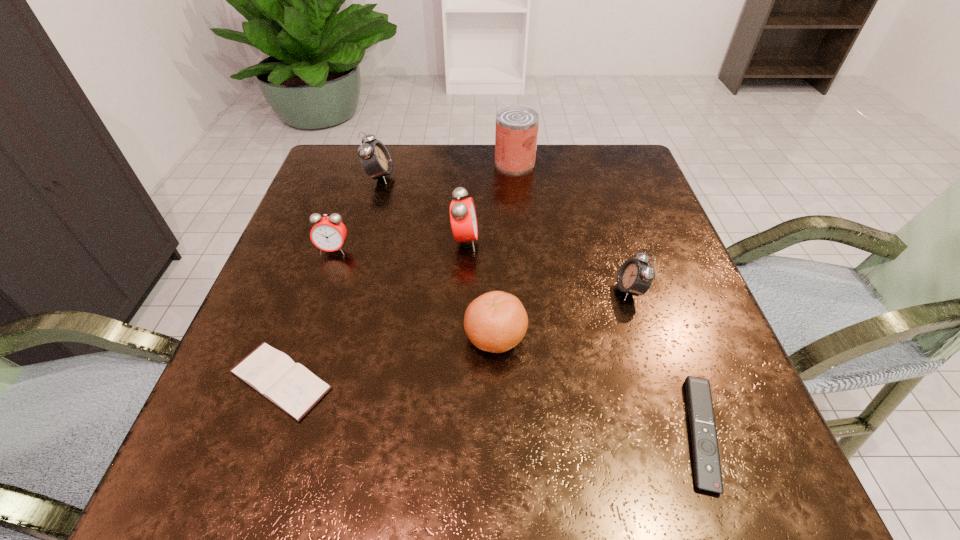
You are a GUI agent. You are given a task and a screenshot of the screen. Output one action in this format:
    pyautogui.click(x=<x>, y=<y>)
    Task: Click on the free spot located 0.290m on the back of the remote control
    The image size is (960, 540).
    Given the screenshot: What is the action you would take?
    pyautogui.click(x=638, y=259)

Identify the location of can located at the far edge. pos(516,133).

You are a GUI agent. You are given a task and a screenshot of the screen. Output one action in this format:
    pyautogui.click(x=<x>, y=<y>)
    Task: Click on the alarm clock at the far edge
    
    Given the screenshot: What is the action you would take?
    pyautogui.click(x=375, y=159)

You are a GUI agent. You are given a task and a screenshot of the screen. Output one action in this format:
    pyautogui.click(x=<x>, y=<y>)
    Task: Click on the object that is at the near edge
    This screenshot has width=960, height=540.
    Given the screenshot: What is the action you would take?
    pyautogui.click(x=707, y=468)

Find the location of a particular element. This screenshot has width=960, height=540. diary at the left edge is located at coordinates (290, 386).

In order to click on alarm clock positioned at the right edge in this screenshot , I will do (635, 277).

You are a GUI agent. You are given a task and a screenshot of the screen. Output one action in this format:
    pyautogui.click(x=<x>, y=<y>)
    Task: Click on the remote control that is at the right edge
    
    Given the screenshot: What is the action you would take?
    pyautogui.click(x=707, y=468)

Find the location of a particular element. Image resolution: width=960 pixels, height=540 pixels. object that is at the far left corner is located at coordinates (375, 159).

The height and width of the screenshot is (540, 960). I want to click on object that is positioned at the near right corner, so click(x=707, y=468).

Locate an element on the screen. This screenshot has height=540, width=960. free point at the far edge is located at coordinates (456, 178).